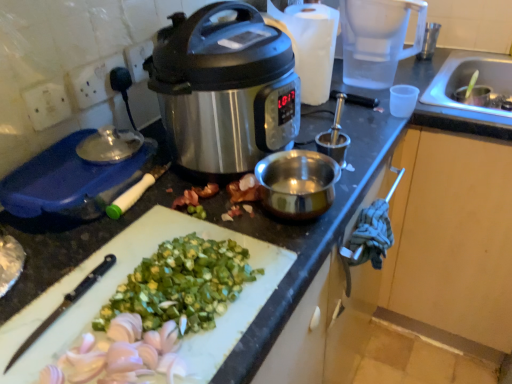
Question: Does point (181, 198) appear closer or farther from the camera than point (5, 329)?

Choices:
 (A) closer
 (B) farther

Answer: (B)

Question: Is green matte okra at center to the left or to the right of white plastic cutting board at lower center in the image?

Choices:
 (A) right
 (B) left

Answer: (A)

Question: Which object is positioned farthest from the metallic silver cup at upper right?

Choices:
 (A) stainless steel slow cooker at center
 (B) transparent plastic blender at upper right
 (C) blue plastic container at left
 (D) white plastic cutting board at lower center
 (E) green matte okra at center

Answer: (D)

Question: Which of these objects is positioned farthest from the blue plastic container at left?

Choices:
 (A) transparent plastic blender at upper right
 (B) metallic silver cup at upper right
 (C) white plastic cutting board at lower center
 (D) stainless steel slow cooker at center
 (E) green matte okra at center

Answer: (B)